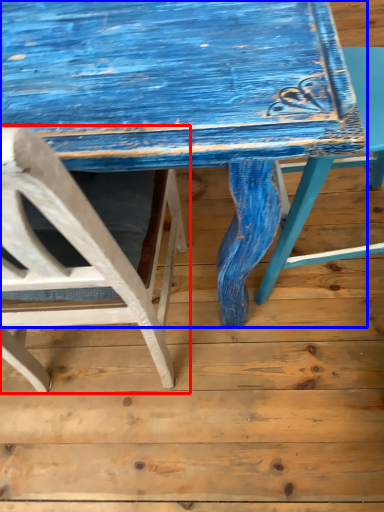
Question: Which object is closer to the camera taking this photo, chair (highlighted by a red box) or table (highlighted by a blue box)?

Choices:
 (A) chair
 (B) table

Answer: (A)